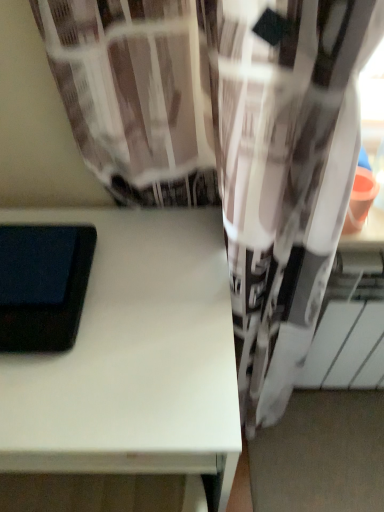
Where is `black matte tablet at left`? The image size is (384, 512). black matte tablet at left is located at coordinates (43, 285).

Describe the element at coordinates (43, 285) in the screenshot. I see `black matte tablet at left` at that location.

Locate an element on the screen. white matte table at center is located at coordinates 133,357.

This screenshot has height=512, width=384. Describe the element at coordinates (133, 357) in the screenshot. I see `white matte table at center` at that location.

What are the coordinates of `black matte tablet at left` in the screenshot? It's located at 43,285.

Which object is positioned more to the right, black matte tablet at left or white matte table at center?

white matte table at center.

Which object is more forward, black matte tablet at left or white matte table at center?

white matte table at center is closer to the camera.

Which is in front, point (55, 318) or point (203, 400)?

The point (203, 400) is in front.

From the image's perspective, which one is positioned higher, black matte tablet at left or white matte table at center?

black matte tablet at left appears higher in the image.

From a real-world perspective, relative to white matte table at center, is black matte tablet at left vertically above or below?

In terms of real-world spatial position, black matte tablet at left is above white matte table at center.

Considering the relative sizes of black matte tablet at left and white matte table at center in the image provided, is black matte tablet at left wider than white matte table at center?

In fact, black matte tablet at left might be narrower than white matte table at center.

Is black matte tablet at left shorter than white matte table at center?

Yes, black matte tablet at left is shorter than white matte table at center.

Looking at this image, between black matte tablet at left and white matte table at center, which one has larger size?

white matte table at center is bigger.

Is black matte tablet at left spatially inside white matte table at center, or outside of it?

black matte tablet at left is not inside white matte table at center, it's outside.

Is black matte tablet at left positioned far away from white matte table at center?

No, black matte tablet at left is in close proximity to white matte table at center.

Is black matte tablet at left oriented away from white matte table at center?

No, black matte tablet at left is not facing away from white matte table at center.

How different are the orientations of black matte tablet at left and white matte table at center in degrees?

black matte tablet at left and white matte table at center are facing 0.15 degrees away from each other.

What are the coordinates of `ipad on the left of white matte table at center` in the screenshot? It's located at (43, 285).

Visually, is white matte table at center positioned to the left or to the right of black matte tablet at left?

In the image, white matte table at center appears on the right side of black matte tablet at left.

Does white matte table at center come in front of black matte tablet at left?

Yes, white matte table at center is closer to the viewer.

Between point (42, 382) and point (61, 270), which one is positioned in front?

The point (42, 382) is in front.

From the image's perspective, is white matte table at center below black matte tablet at left?

Correct, white matte table at center appears lower than black matte tablet at left in the image.

In the scene shown: From a real-world perspective, which object rests below the other?

From a 3D spatial view, white matte table at center is below.

In terms of width, does white matte table at center look wider or thinner when compared to black matte tablet at left?

In the image, white matte table at center appears to be wider than black matte tablet at left.

In the scene shown: Between white matte table at center and black matte tablet at left, which one has more height?

With more height is white matte table at center.

Which of these two, white matte table at center or black matte tablet at left, is bigger?

white matte table at center.

Which is correct: white matte table at center is inside black matte tablet at left, or outside of it?

white matte table at center is not enclosed by black matte tablet at left.

Is white matte table at center next to black matte tablet at left and touching it?

white matte table at center is not next to black matte tablet at left, and they're not touching.

Could you tell me if white matte table at center is facing black matte tablet at left?

No, white matte table at center is not oriented towards black matte tablet at left.

How distant is white matte table at center from black matte tablet at left?

white matte table at center and black matte tablet at left are 4.69 inches apart from each other.

The height and width of the screenshot is (512, 384). What are the coordinates of `ipad lying on the left of white matte table at center` in the screenshot? It's located at (43, 285).

The image size is (384, 512). In order to click on table that appears on the right of black matte tablet at left in this screenshot , I will do `click(133, 357)`.

Locate an element on the screen. ipad that appears above the white matte table at center (from a real-world perspective) is located at coordinates (43, 285).